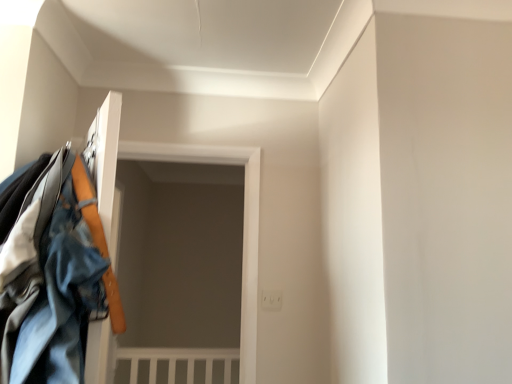
Question: From the image's perspective, is denim jacket at left located above or below denim jacket at left?

Choices:
 (A) below
 (B) above

Answer: (B)

Question: Considering the positions of denim jacket at left and denim jacket at left in the image, is denim jacket at left taller or shorter than denim jacket at left?

Choices:
 (A) tall
 (B) short

Answer: (B)

Question: Considering the positions of denim jacket at left and denim jacket at left in the image, is denim jacket at left bigger or smaller than denim jacket at left?

Choices:
 (A) big
 (B) small

Answer: (A)

Question: Considering their positions, is denim jacket at left located in front of or behind denim jacket at left?

Choices:
 (A) front
 (B) behind

Answer: (B)

Question: In terms of width, does denim jacket at left look wider or thinner when compared to denim jacket at left?

Choices:
 (A) wide
 (B) thin

Answer: (B)

Question: From their relative heights in the image, would you say denim jacket at left is taller or shorter than denim jacket at left?

Choices:
 (A) tall
 (B) short

Answer: (A)

Question: Considering the positions of denim jacket at left and denim jacket at left in the image, is denim jacket at left bigger or smaller than denim jacket at left?

Choices:
 (A) big
 (B) small

Answer: (B)